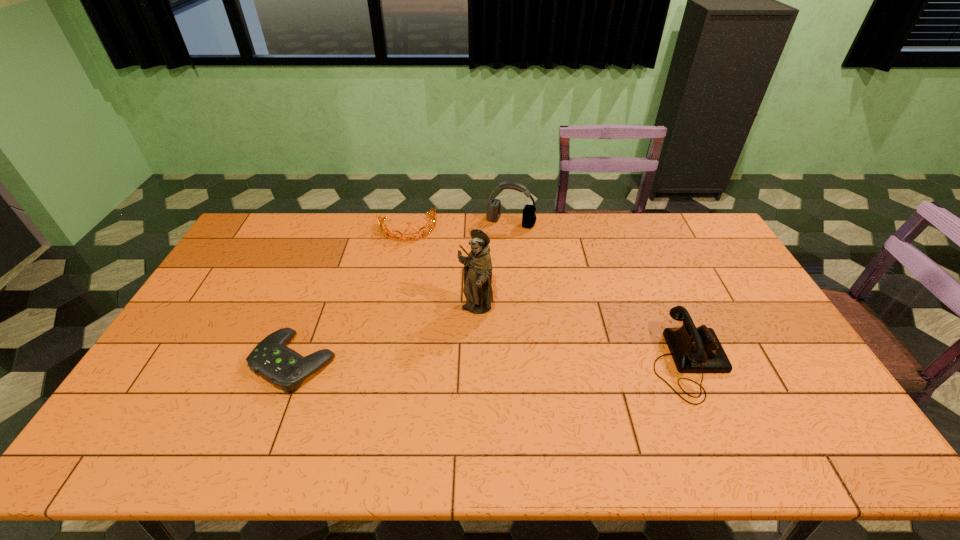
This screenshot has width=960, height=540. Identify the location of vacant space positioned 0.150m on the front face of the third tallest object. pos(780,362).

Locate an element on the screen. vacant area situated on the headband of the headset is located at coordinates (481, 276).

Identify the location of free location located on the headband of the headset. (486, 267).

I want to click on free point located 0.110m on the headband of the headset, so click(495, 247).

Where is `vacant space located 0.050m on the front-facing side of the second object from left to right`? This screenshot has width=960, height=540. vacant space located 0.050m on the front-facing side of the second object from left to right is located at coordinates (413, 251).

You are a GUI agent. You are given a task and a screenshot of the screen. Output one action in this format:
    pyautogui.click(x=<x>, y=<y>)
    Task: Click on the vacant region located 0.230m on the front-facing side of the second object from left to right
    
    Given the screenshot: What is the action you would take?
    pyautogui.click(x=420, y=285)

Where is `vacant area situated 0.200m on the front-facing side of the second object from left to right`? vacant area situated 0.200m on the front-facing side of the second object from left to right is located at coordinates (418, 279).

Where is `vacant area situated on the front-facing side of the figurine`? vacant area situated on the front-facing side of the figurine is located at coordinates (466, 348).

Find the location of `free space located on the front-facing side of the figurine`. free space located on the front-facing side of the figurine is located at coordinates (457, 380).

You are a GUI agent. You are given a task and a screenshot of the screen. Output one action in this format:
    pyautogui.click(x=<x>, y=<y>)
    Task: Click on the vacant space situated 0.280m on the front-facing side of the figurine
    Image resolution: width=960 pixels, height=540 pixels.
    Given the screenshot: What is the action you would take?
    pyautogui.click(x=450, y=403)